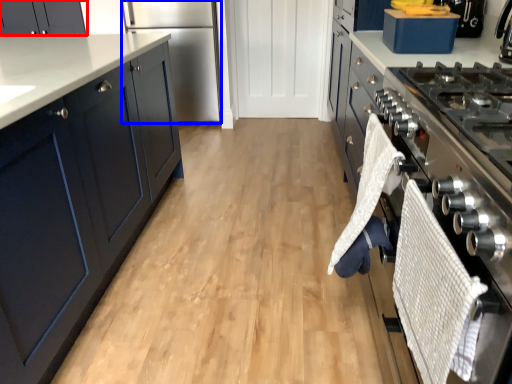
Question: Which object is closer to the camera taking this photo, cabinetry (highlighted by a red box) or refrigerator (highlighted by a blue box)?

Choices:
 (A) cabinetry
 (B) refrigerator

Answer: (B)